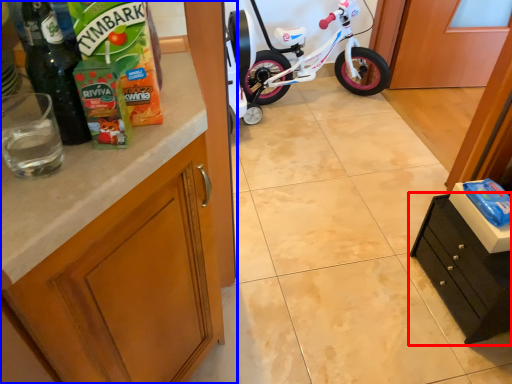
Question: Which point is further to the camera, cabinetry (highlighted by a red box) or cabinetry (highlighted by a blue box)?

Choices:
 (A) cabinetry
 (B) cabinetry

Answer: (A)